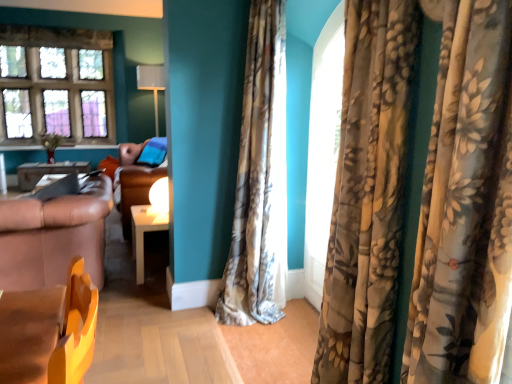
Question: Is floral velvet curtains at right, which is the 1th curtain in front-to-back order, next to metallic silver table at left, the second table in the front-to-back sequence?

Choices:
 (A) yes
 (B) no

Answer: (B)

Question: Considering the relative sizes of floral velvet curtains at right, which is the 1th curtain in front-to-back order, and metallic silver table at left, the second table ordered from the bottom, in the image provided, is floral velvet curtains at right, which is the 1th curtain in front-to-back order, bigger than metallic silver table at left, the second table ordered from the bottom,?

Choices:
 (A) yes
 (B) no

Answer: (A)

Question: From a real-world perspective, is floral velvet curtains at right, the second curtain viewed from the left, positioned under metallic silver table at left, the second table in the front-to-back sequence, based on gravity?

Choices:
 (A) no
 (B) yes

Answer: (A)

Question: Is floral velvet curtains at right, the second curtain viewed from the left, further to camera compared to metallic silver table at left, the second table in the front-to-back sequence?

Choices:
 (A) no
 (B) yes

Answer: (A)

Question: From a real-world perspective, does floral velvet curtains at right, which is the 1th curtain in front-to-back order, stand above metallic silver table at left, the 2th table positioned from the right?

Choices:
 (A) yes
 (B) no

Answer: (A)

Question: From the image's perspective, is floral velvet curtains at right, the second curtain viewed from the left, located above metallic silver table at left, acting as the first table starting from the top?

Choices:
 (A) no
 (B) yes

Answer: (A)

Question: Is floral silk curtain at center, the 1th curtain positioned from the left, closer to camera compared to brown leather couch at center?

Choices:
 (A) yes
 (B) no

Answer: (A)

Question: Could you tell me if floral silk curtain at center, placed as the 2th curtain when sorted from front to back, is turned towards brown leather couch at center?

Choices:
 (A) no
 (B) yes

Answer: (A)

Question: Is floral silk curtain at center, the second curtain when ordered from right to left, shorter than brown leather couch at center?

Choices:
 (A) yes
 (B) no

Answer: (B)

Question: Is brown leather couch at center inside floral silk curtain at center, the 1th curtain positioned from the left?

Choices:
 (A) yes
 (B) no

Answer: (B)

Question: Does floral silk curtain at center, the 1th curtain positioned from the left, have a greater height compared to brown leather couch at center?

Choices:
 (A) yes
 (B) no

Answer: (A)

Question: Is floral silk curtain at center, arranged as the 1th curtain when viewed from the back, at the left side of brown leather couch at center?

Choices:
 (A) no
 (B) yes

Answer: (A)

Question: Considering the relative positions of white glossy table at center, the first table positioned from the right, and stained glass window at upper left in the image provided, is white glossy table at center, the first table positioned from the right, behind stained glass window at upper left?

Choices:
 (A) yes
 (B) no

Answer: (B)